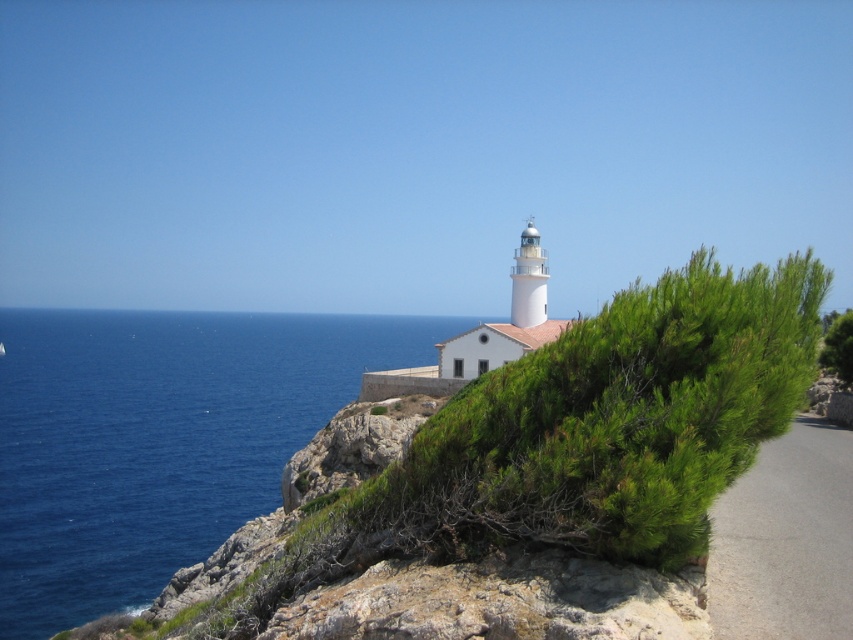
You are standing at the center of the lighthouse observation deck and want to look at the blue liquid water at left. In which direction should you look?

You should look to the left because the blue liquid water at left is located at the left side of the scene.

You are a bird flying over the coastal scene described. You need to land on either the blue liquid water at left or the green leafy shrub at upper right. Which surface can you safely land on, and why?

The green leafy shrub at upper right is the safer option because the blue liquid water at left is taller than the shrub, meaning the water is deeper there, making it unsuitable for landing. The shrub provides a solid surface for the bird to land on safely.

Based on the photo, you are a painter planning to sketch this coastal scene. You need to decide which area to focus on first based on their sizes. Which object should you sketch first, the blue liquid water at left or the green leafy shrub at upper right, if you want to capture the larger one first?

The blue liquid water at left should be sketched first because its width surpasses that of the green leafy shrub at upper right, making it the larger object in the scene.